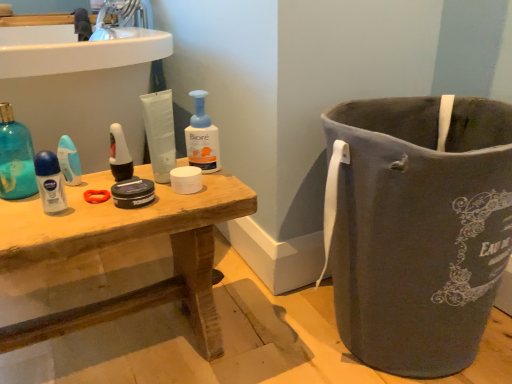
Find the location of a particular element. spots to the right of translucent plastic deodorant stick at left, which ranks as the 2th cleaning product in right-to-left order is located at coordinates (98, 193).